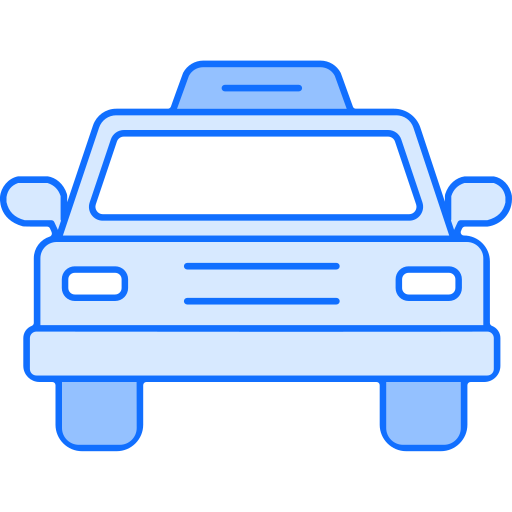
This screenshot has height=512, width=512. I want to click on empty space on front window, so click(x=229, y=168).